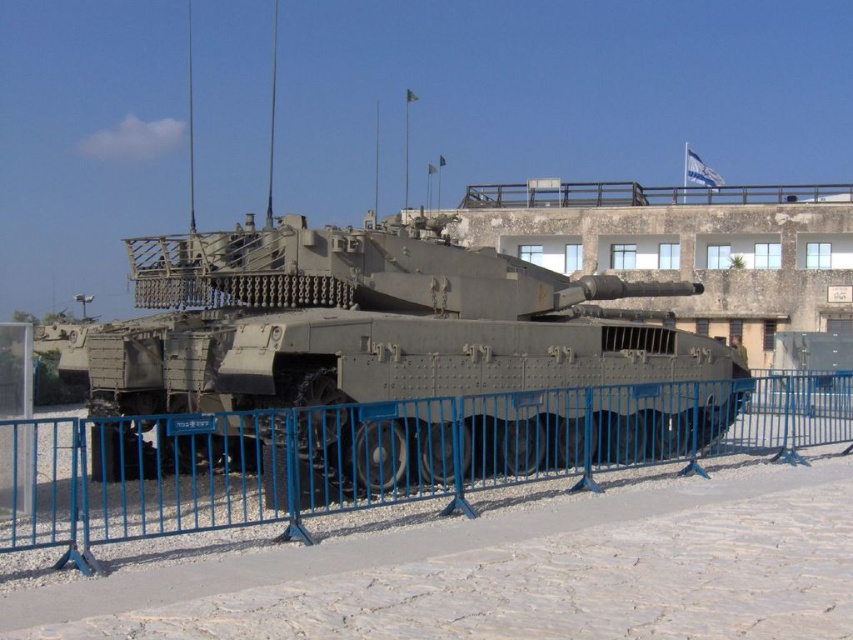
You are a museum guide standing at coordinates 0.5, 0.4. A visitor asks, which direction should I move to reach the camouflage paint tank at center? Please answer with a direction like north, south, east, west, or a combination like northeast.

The camouflage paint tank at center is located at coordinates [370,333]. Since you are at [340,320], you should move northeast to reach it.

You are a visitor at the museum and want to take a photo of the camouflage paint tank at center and the blue metal fence at lower center. Which object is closer to the left side of the frame?

The camouflage paint tank at center is positioned on the left side of blue metal fence at lower center, so it is closer to the left side of the frame.